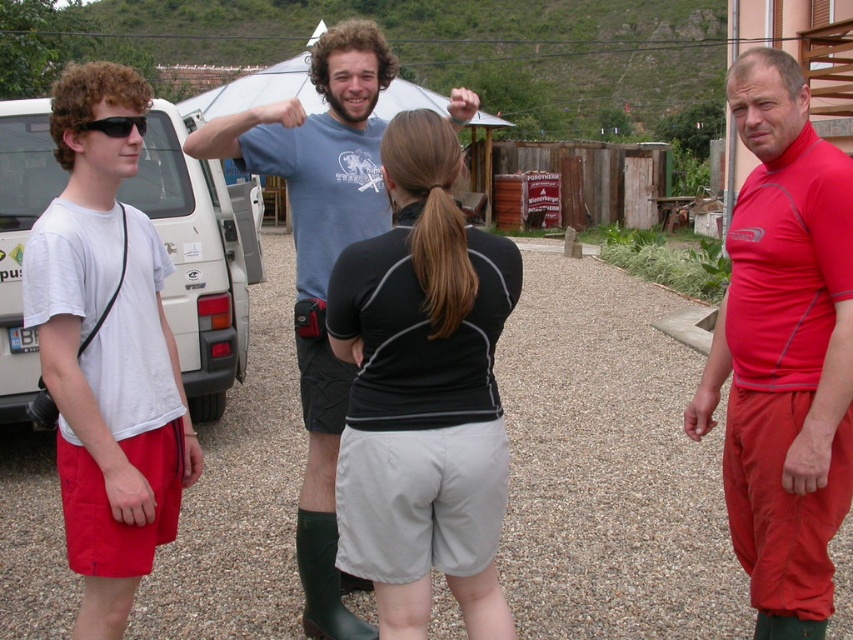
Question: Can you confirm if black matte shorts at center is positioned to the right of white matte van at left?

Choices:
 (A) no
 (B) yes

Answer: (B)

Question: Is black matte shorts at center wider than blue cotton t-shirt at center?

Choices:
 (A) yes
 (B) no

Answer: (B)

Question: Which of the following is the closest to the observer?

Choices:
 (A) blue cotton t-shirt at center
 (B) white cotton t-shirt at left

Answer: (B)

Question: Which point is farther from the camera taking this photo?

Choices:
 (A) (131, 118)
 (B) (341, 156)

Answer: (B)

Question: Is black matte shorts at center bigger than white cotton t-shirt at left?

Choices:
 (A) no
 (B) yes

Answer: (A)

Question: Which point is farther to the camera?

Choices:
 (A) (138, 208)
 (B) (79, 538)

Answer: (A)